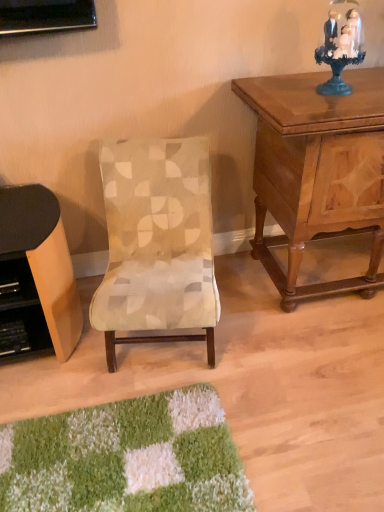
Where is `free spot below wooden nightstand at upper right (from a real-world perspective)`? This screenshot has height=512, width=384. free spot below wooden nightstand at upper right (from a real-world perspective) is located at coordinates (330, 262).